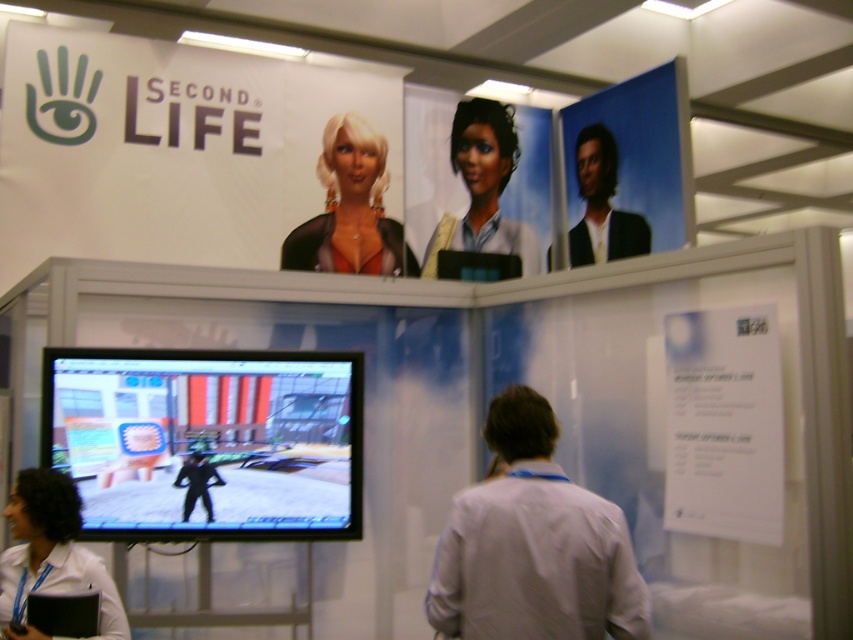
You are organizing a virtual fashion show and need to decide which outfit to feature first. Based on the image, which outfit is bigger in size between the white shirt at lower left and the black matte suit at center?

The white shirt at lower left has a larger size compared to the black matte suit at center, so the white shirt at lower left should be featured first due to its bigger size.

You are at the Second Life booth and want to touch the banner with the text. You notice two points marked on the banner. The first point is at coordinates point (537, 531) and the second point is at point (750, 348). Which point is closer to you if you are standing directly in front of the banner?

Point (537, 531) is in front of point (750, 348), so the first point is closer to you.

You are standing at the camera position looking at the Second Life booth. There is a point marked at coordinates point (520, 474). Can you reach this point by taking a step forward without moving sideways?

The point (520, 474) is 1.94 meters away from the camera, so yes, you can reach it by taking a step forward since it is within a typical stepping distance.